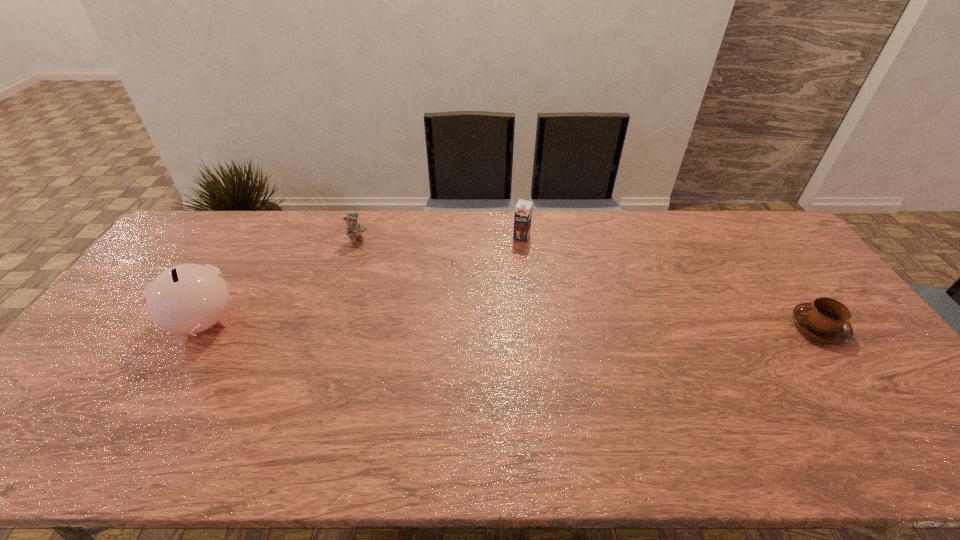
This screenshot has height=540, width=960. Identify the location of vacant space located on the side of the shortest object with the handle. (735, 327).

This screenshot has width=960, height=540. I want to click on free region located on the side of the shortest object with the handle, so click(742, 327).

At what (x,y) coordinates should I click in order to perform the action: click on vacant area situated 0.350m on the front label of the second object from right to left. Please return your answer as a coordinate pair (x, y). Image resolution: width=960 pixels, height=540 pixels. Looking at the image, I should click on (485, 313).

The image size is (960, 540). I want to click on free space located 0.050m on the front label of the second object from right to left, so click(515, 251).

What are the coordinates of `free point located 0.350m on the front label of the second object from right to left` in the screenshot? It's located at (485, 313).

I want to click on free space located 0.380m on the front-facing side of the second shortest object, so click(x=442, y=302).

I want to click on vacant space located on the front-facing side of the second shortest object, so click(437, 299).

The height and width of the screenshot is (540, 960). Identify the location of vacant space positioned on the front-facing side of the second shortest object. (435, 297).

Where is `chocolate milk that is positioned at the far edge`? The image size is (960, 540). chocolate milk that is positioned at the far edge is located at coordinates (523, 210).

Locate an element on the screen. The width and height of the screenshot is (960, 540). teddy bear situated at the far edge is located at coordinates (354, 229).